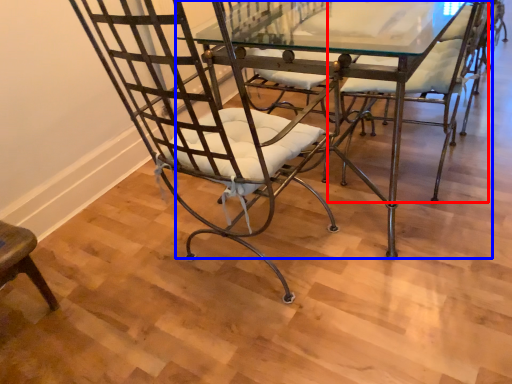
Question: Which object appears farthest to the camera in this image, chair (highlighted by a red box) or table (highlighted by a blue box)?

Choices:
 (A) chair
 (B) table

Answer: (A)